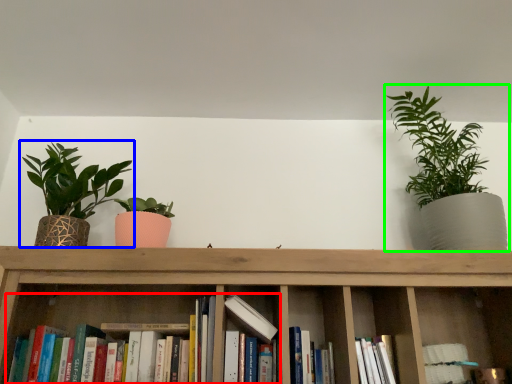
Question: Which object is the farthest from book (highlighted by a red box)? Choose among these: houseplant (highlighted by a blue box) or houseplant (highlighted by a green box).

Choices:
 (A) houseplant
 (B) houseplant

Answer: (B)